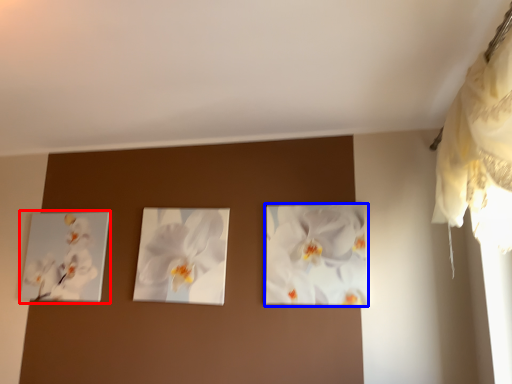
Question: Among these objects, which one is farthest to the camera, picture frame (highlighted by a red box) or flower (highlighted by a blue box)?

Choices:
 (A) picture frame
 (B) flower

Answer: (A)